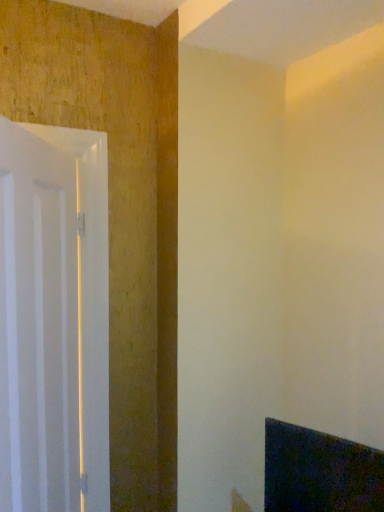
The width and height of the screenshot is (384, 512). Identify the location of white matte door at left. (54, 320).

Describe the element at coordinates (54, 320) in the screenshot. This screenshot has height=512, width=384. I see `white matte door at left` at that location.

Looking at this image, measure the distance between white matte door at left and camera.

white matte door at left and camera are 30.56 inches apart from each other.

At what (x,y) coordinates should I click in order to perform the action: click on white matte door at left. Please return your answer as a coordinate pair (x, y). Looking at the image, I should click on coord(54,320).